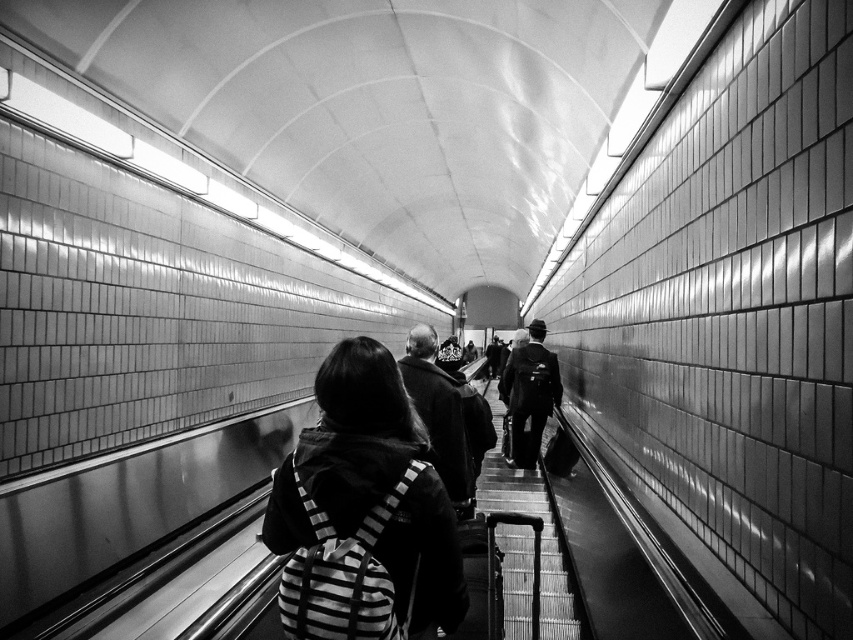
Can you confirm if striped fabric backpack at center is positioned to the left of dark gray suit at center?

Correct, you'll find striped fabric backpack at center to the left of dark gray suit at center.

Is striped fabric backpack at center shorter than dark gray suit at center?

Correct, striped fabric backpack at center is not as tall as dark gray suit at center.

The image size is (853, 640). What do you see at coordinates (372, 490) in the screenshot?
I see `striped fabric backpack at center` at bounding box center [372, 490].

The image size is (853, 640). I want to click on striped fabric backpack at center, so click(372, 490).

Who is taller, striped fabric backpack at center or dark wool coat at center?

dark wool coat at center

Is point (358, 381) farther from camera compared to point (461, 372)?

No.

Does point (315, 426) come in front of point (413, 333)?

Yes, it is.

Find the location of a particular element. striped fabric backpack at center is located at coordinates (372, 490).

Does point (421, 353) come closer to viewer compared to point (537, 381)?

Yes, it is.

Can you confirm if dark wool coat at center is smaller than dark gray suit at center?

No, dark wool coat at center is not smaller than dark gray suit at center.

At what (x,y) coordinates should I click in order to perform the action: click on dark wool coat at center. Please return your answer as a coordinate pair (x, y). The image size is (853, 640). Looking at the image, I should click on (447, 416).